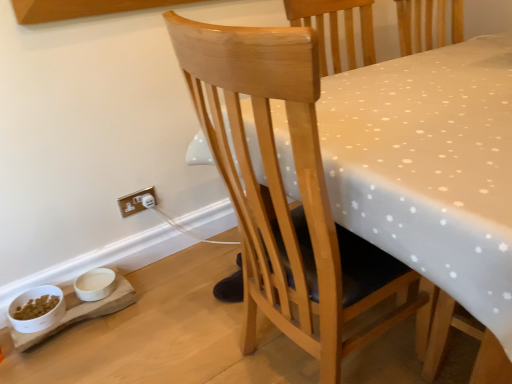
Question: Should I look upward or downward to see gold metallic electrical outlet at lower left?

Choices:
 (A) down
 (B) up

Answer: (A)

Question: Is gold metallic electrical outlet at lower left completely or partially inside natural wood chair at center?

Choices:
 (A) no
 (B) yes

Answer: (A)

Question: Does natural wood chair at center touch gold metallic electrical outlet at lower left?

Choices:
 (A) no
 (B) yes

Answer: (A)

Question: Is natural wood chair at center oriented towards gold metallic electrical outlet at lower left?

Choices:
 (A) yes
 (B) no

Answer: (B)

Question: Can you confirm if natural wood chair at center is positioned to the right of gold metallic electrical outlet at lower left?

Choices:
 (A) no
 (B) yes

Answer: (B)

Question: Considering the relative sizes of natural wood chair at center and gold metallic electrical outlet at lower left in the image provided, is natural wood chair at center taller than gold metallic electrical outlet at lower left?

Choices:
 (A) no
 (B) yes

Answer: (B)

Question: Is natural wood chair at center smaller than gold metallic electrical outlet at lower left?

Choices:
 (A) yes
 (B) no

Answer: (B)

Question: Is natural wood chair at center oriented towards white matte bowl at lower left, the second bowl viewed from the left?

Choices:
 (A) no
 (B) yes

Answer: (A)

Question: From a real-world perspective, is natural wood chair at center located higher than white matte bowl at lower left, the 1th bowl viewed from the right?

Choices:
 (A) no
 (B) yes

Answer: (B)

Question: From a real-world perspective, is natural wood chair at center physically below white matte bowl at lower left, the 1th bowl viewed from the right?

Choices:
 (A) yes
 (B) no

Answer: (B)

Question: Is natural wood chair at center further to the viewer compared to white matte bowl at lower left, the second bowl viewed from the left?

Choices:
 (A) no
 (B) yes

Answer: (A)

Question: Considering the relative positions of natural wood chair at center and white matte bowl at lower left, the second bowl viewed from the left, in the image provided, is natural wood chair at center to the right of white matte bowl at lower left, the second bowl viewed from the left, from the viewer's perspective?

Choices:
 (A) yes
 (B) no

Answer: (A)

Question: Is natural wood chair at center completely or partially outside of white matte bowl at lower left, the second bowl viewed from the left?

Choices:
 (A) yes
 (B) no

Answer: (A)

Question: Can you confirm if natural wood chair at center is taller than white glossy bowl at lower left, which appears as the 1th bowl when viewed from the left?

Choices:
 (A) no
 (B) yes

Answer: (B)